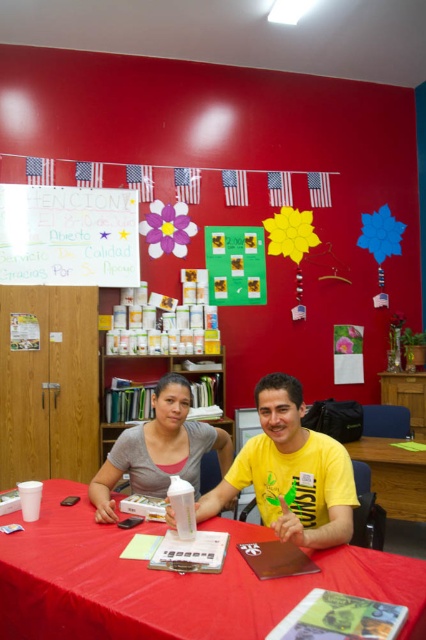
Question: Does smooth plastic table at center appear on the right side of colored paper sign at upper left?

Choices:
 (A) no
 (B) yes

Answer: (B)

Question: Does colored paper sign at upper left appear under matte white lotion at center?

Choices:
 (A) no
 (B) yes

Answer: (A)

Question: Can you confirm if yellow matte shirt at center is positioned above colored paper sign at upper left?

Choices:
 (A) yes
 (B) no

Answer: (B)

Question: Estimate the real-world distances between objects in this image. Which object is closer to the matte white lotion at center?

Choices:
 (A) yellow matte shirt at center
 (B) smooth plastic table at center

Answer: (A)

Question: Which object is farther from the camera taking this photo?

Choices:
 (A) wooden bookshelf at center
 (B) colored paper sign at upper left

Answer: (B)

Question: Among these objects, which one is nearest to the camera?

Choices:
 (A) wooden bookshelf at center
 (B) matte white lotion at center
 (C) yellow matte shirt at center

Answer: (C)